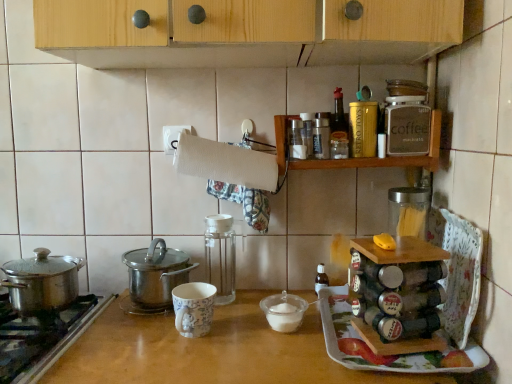
Locate an element on the screen. free region on the left part of metallic silver spice rack at center right, which ranks as the second appliance in left-to-right order is located at coordinates (336, 336).